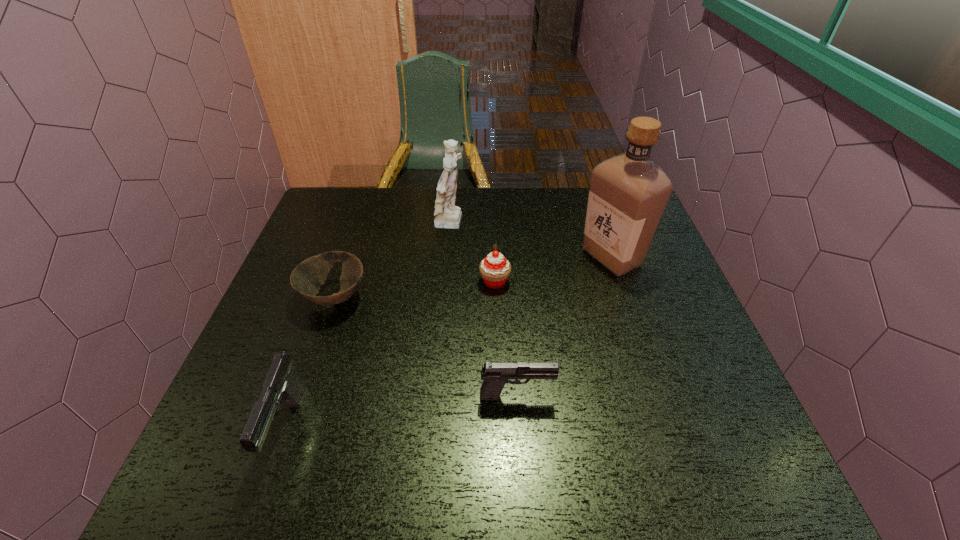
Image resolution: width=960 pixels, height=540 pixels. In order to click on free space in the image that satisfies the following two spatial constraints: 1. on the front-facing side of the cupcake; 2. on the left side of the second tallest object in this screenshot , I will do `click(447, 281)`.

At what (x,y) coordinates should I click in order to perform the action: click on free region that satisfies the following two spatial constraints: 1. on the front-facing side of the figurine; 2. aim along the barrel of the taller pistol. Please return your answer as a coordinate pair (x, y). Looking at the image, I should click on (437, 428).

This screenshot has height=540, width=960. What are the coordinates of `free space that satisfies the following two spatial constraints: 1. on the front-facing side of the tallest object; 2. on the front side of the cupcake` in the screenshot? It's located at (620, 281).

What are the coordinates of `free location that satisfies the following two spatial constraints: 1. on the front-facing side of the second tallest object; 2. aim along the barrel of the fourth shortest object` in the screenshot? It's located at (437, 428).

Where is `vacant area in the image that satisfies the following two spatial constraints: 1. aim along the barrel of the shorter pistol; 2. aim along the barrel of the left pistol`? The image size is (960, 540). vacant area in the image that satisfies the following two spatial constraints: 1. aim along the barrel of the shorter pistol; 2. aim along the barrel of the left pistol is located at coordinates (518, 428).

You are a GUI agent. You are given a task and a screenshot of the screen. Output one action in this format:
    pyautogui.click(x=<x>, y=<y>)
    Task: Click on the vacant area in the image that satisfies the following two spatial constraints: 1. on the front-facing side of the figurine; 2. aim along the barrel of the taller pistol
    Image resolution: width=960 pixels, height=540 pixels.
    Given the screenshot: What is the action you would take?
    pyautogui.click(x=437, y=428)